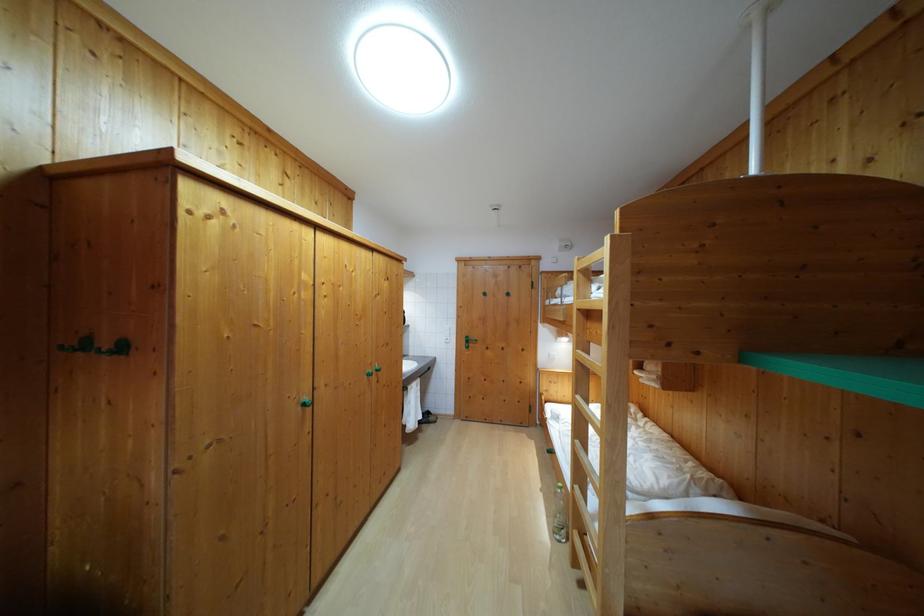
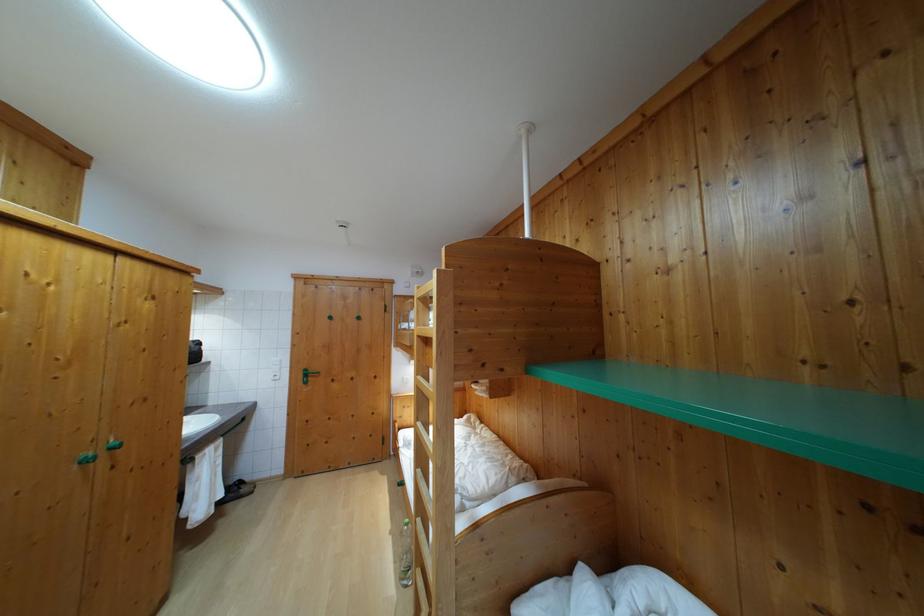
The point at (581, 317) is marked in the first image. Where is the corresponding point in the second image?

(421, 342)